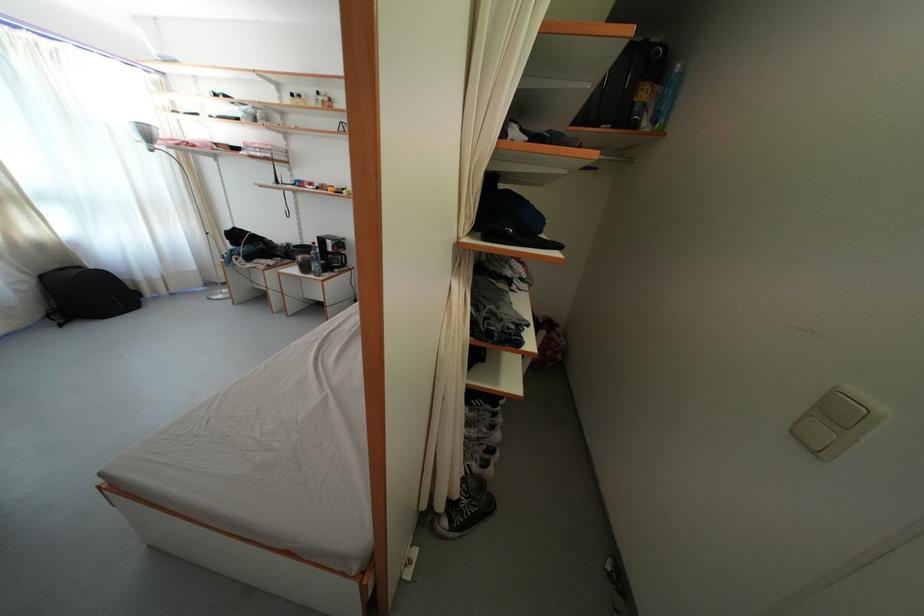
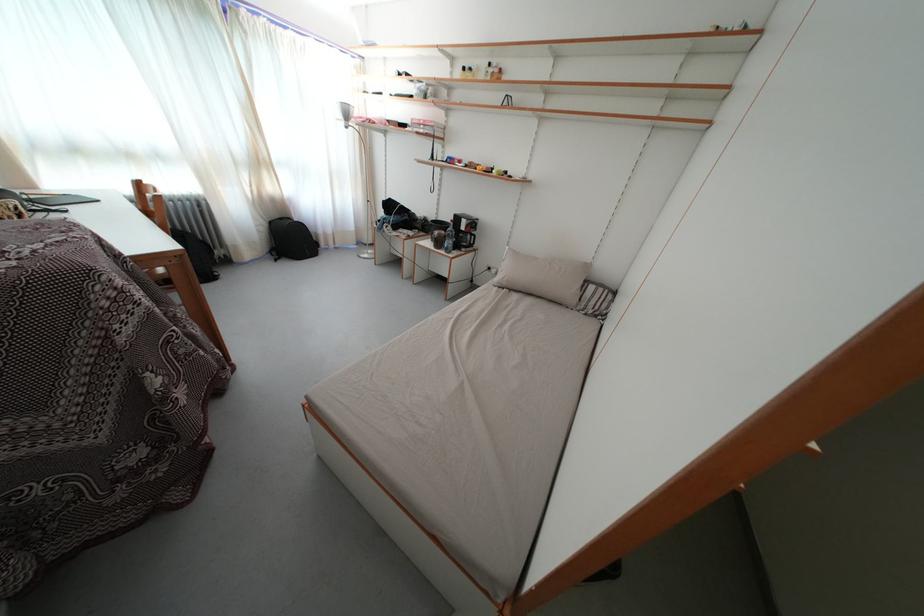
Question: The images are taken continuously from a first-person perspective. In which direction are you moving?

Choices:
 (A) Left
 (B) Right
 (C) Forward
 (D) Backward

Answer: (A)